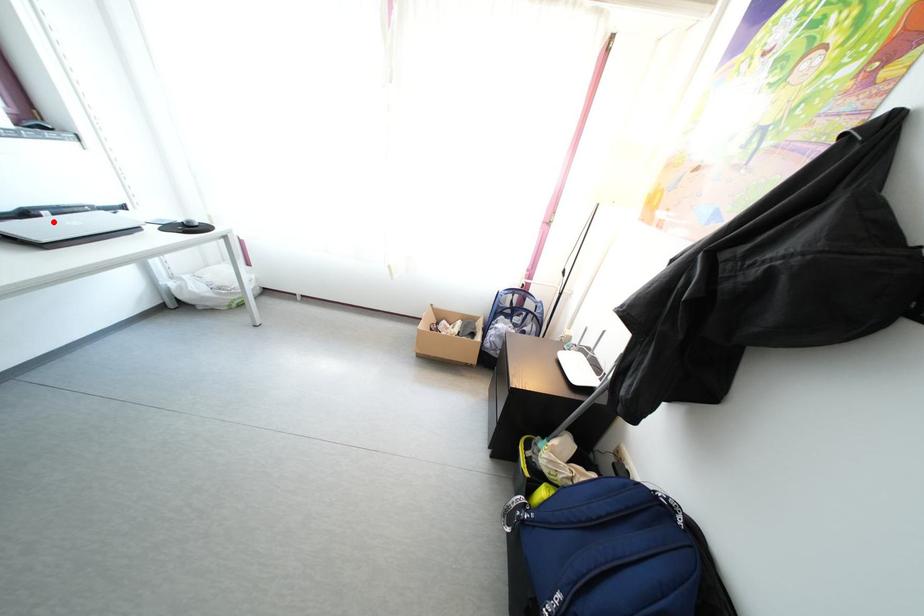
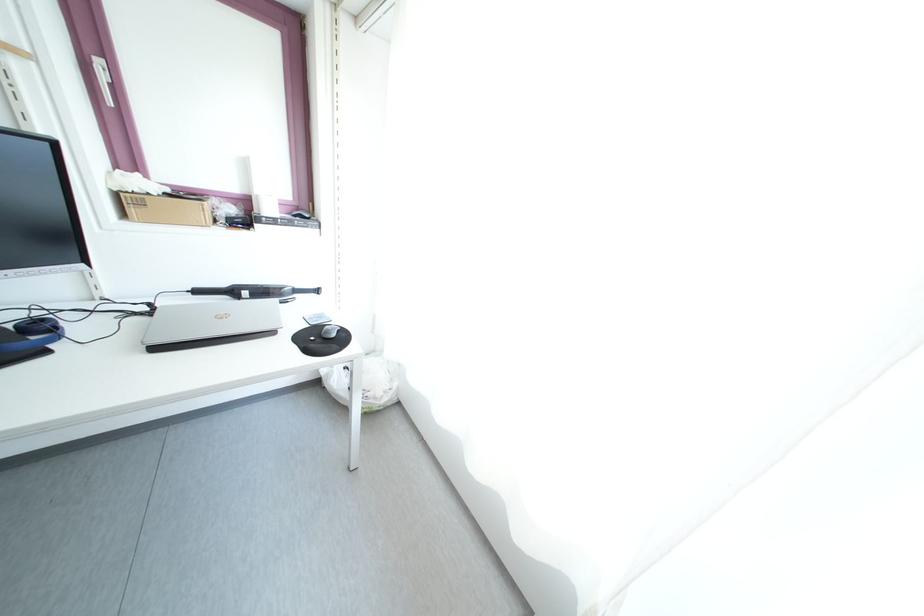
Locate, in the second image, the point that corresponds to the highlighted location in the first image.

(251, 302)